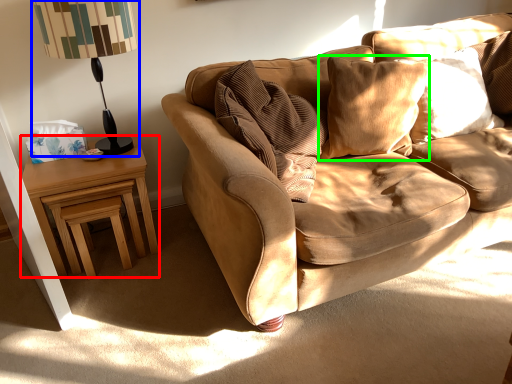
Question: Which object is the farthest from nightstand (highlighted by a red box)? Choose among these: table lamp (highlighted by a blue box) or pillow (highlighted by a green box).

Choices:
 (A) table lamp
 (B) pillow

Answer: (B)